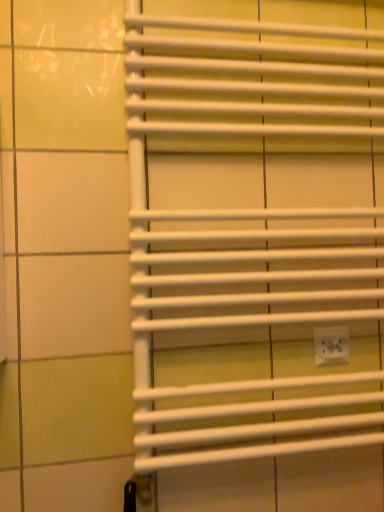
Question: Considering the relative positions of white matte towel rack at center and white plastic electric outlet at lower right in the image provided, is white matte towel rack at center in front of white plastic electric outlet at lower right?

Choices:
 (A) yes
 (B) no

Answer: (A)

Question: From a real-world perspective, is white matte towel rack at center over white plastic electric outlet at lower right?

Choices:
 (A) no
 (B) yes

Answer: (B)

Question: Does white matte towel rack at center have a larger size compared to white plastic electric outlet at lower right?

Choices:
 (A) yes
 (B) no

Answer: (A)

Question: Is white matte towel rack at center at the left side of white plastic electric outlet at lower right?

Choices:
 (A) yes
 (B) no

Answer: (A)

Question: Considering the relative sizes of white matte towel rack at center and white plastic electric outlet at lower right in the image provided, is white matte towel rack at center taller than white plastic electric outlet at lower right?

Choices:
 (A) yes
 (B) no

Answer: (A)

Question: Considering the relative sizes of white matte towel rack at center and white plastic electric outlet at lower right in the image provided, is white matte towel rack at center smaller than white plastic electric outlet at lower right?

Choices:
 (A) yes
 (B) no

Answer: (B)

Question: Can you see white plastic electric outlet at lower right touching white matte towel rack at center?

Choices:
 (A) yes
 (B) no

Answer: (B)

Question: Is white plastic electric outlet at lower right to the right of white matte towel rack at center from the viewer's perspective?

Choices:
 (A) no
 (B) yes

Answer: (B)

Question: Is white plastic electric outlet at lower right shorter than white matte towel rack at center?

Choices:
 (A) no
 (B) yes

Answer: (B)

Question: Is white matte towel rack at center at the back of white plastic electric outlet at lower right?

Choices:
 (A) yes
 (B) no

Answer: (A)

Question: Could white matte towel rack at center be considered to be inside white plastic electric outlet at lower right?

Choices:
 (A) no
 (B) yes

Answer: (A)

Question: Is white plastic electric outlet at lower right thinner than white matte towel rack at center?

Choices:
 (A) no
 (B) yes

Answer: (B)

Question: In terms of height, does white plastic electric outlet at lower right look taller or shorter compared to white matte towel rack at center?

Choices:
 (A) tall
 (B) short

Answer: (B)